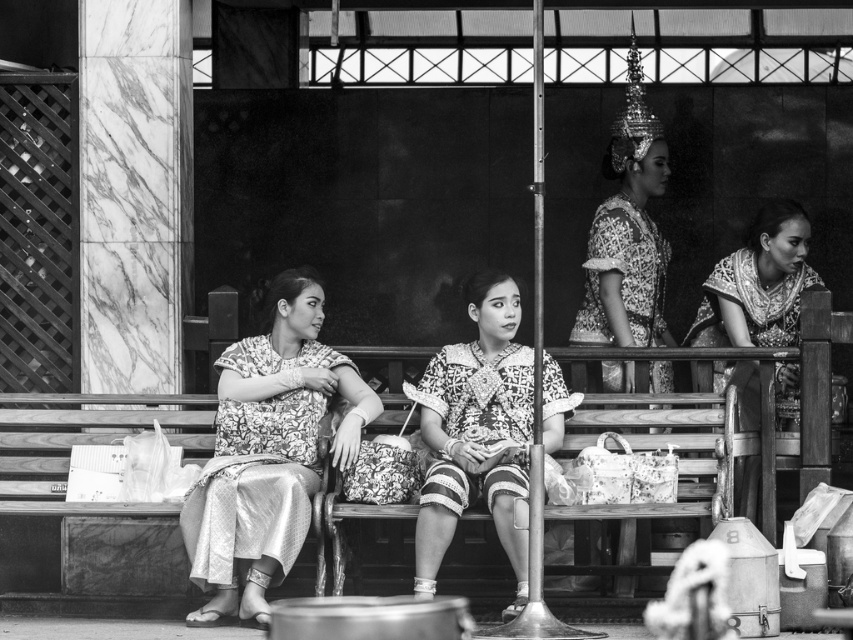
In the scene described, where exactly is the printed silk dress at center located in terms of coordinates?

The printed silk dress at center is located at point (268, 451).

You are an anthropologist studying traditional clothing. You observe two garments in the scene described above. The first is the printed silk dress at center, and the second is the patterned fabric skirt at center. Based on the visual evidence, which garment appears to be larger in size?

The printed silk dress at center is larger in size than the patterned fabric skirt at center.